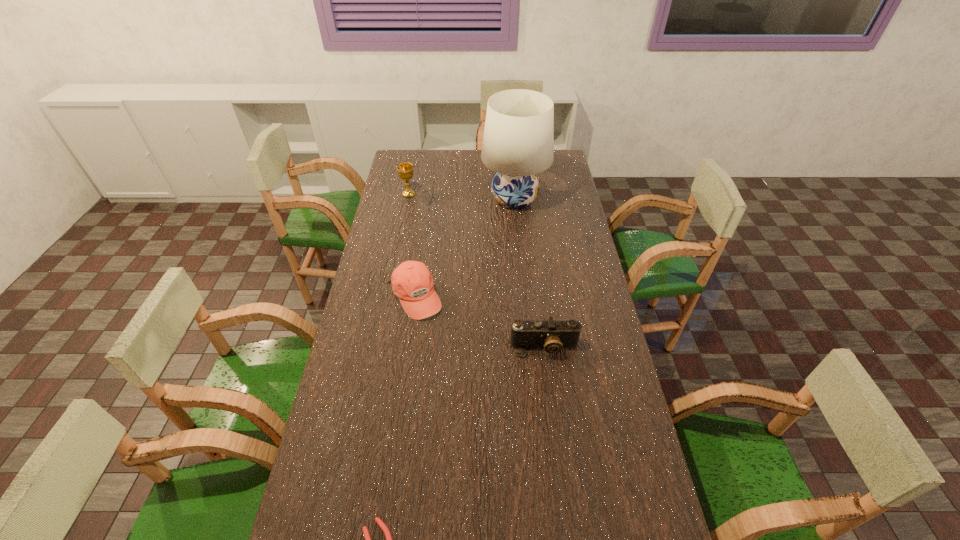
This screenshot has height=540, width=960. What are the coordinates of `free space between the baseball cap and the lampshade` in the screenshot? It's located at (465, 248).

Find the location of a particular element. The image size is (960, 540). free space between the chalice and the baseball cap is located at coordinates (412, 246).

Identify the location of vacant point located between the baseball cap and the fourth farthest object. Image resolution: width=960 pixels, height=540 pixels. (480, 322).

Point out which object is positioned as the fourth nearest to the second nearest object. Please provide its 2D coordinates. Your answer should be formatted as a tuple, i.e. [(x, y)], where the tuple contains the x and y coordinates of a point satisfying the conditions above.

[(405, 170)]

Identify which object is the third closest to the nearest object. Please provide its 2D coordinates. Your answer should be formatted as a tuple, i.e. [(x, y)], where the tuple contains the x and y coordinates of a point satisfying the conditions above.

[(518, 143)]